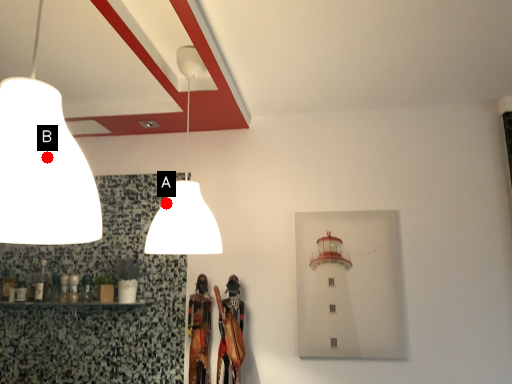
Question: Two points are circled on the image, labeled by A and B beside each circle. Which point is closer to the camera taking this photo?

Choices:
 (A) A is closer
 (B) B is closer

Answer: (B)